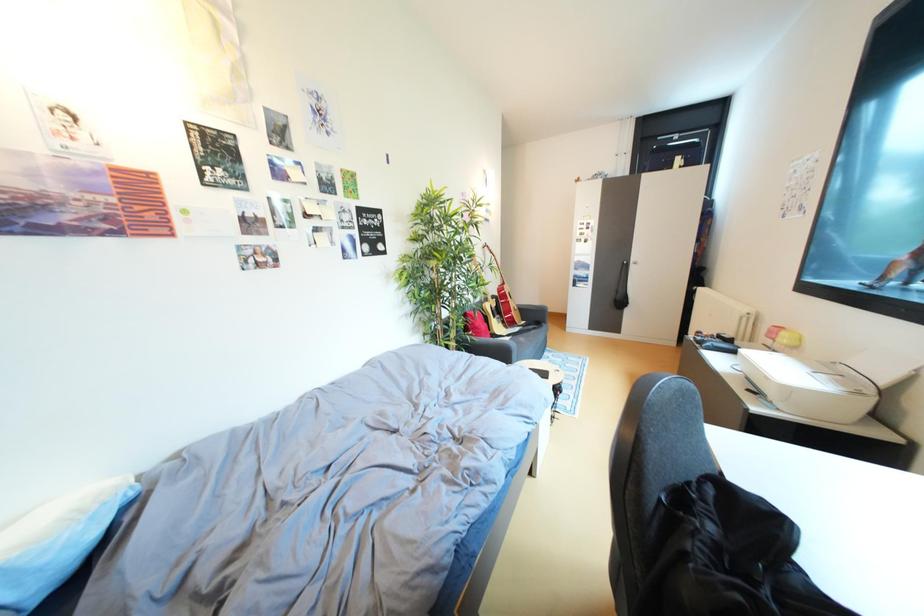
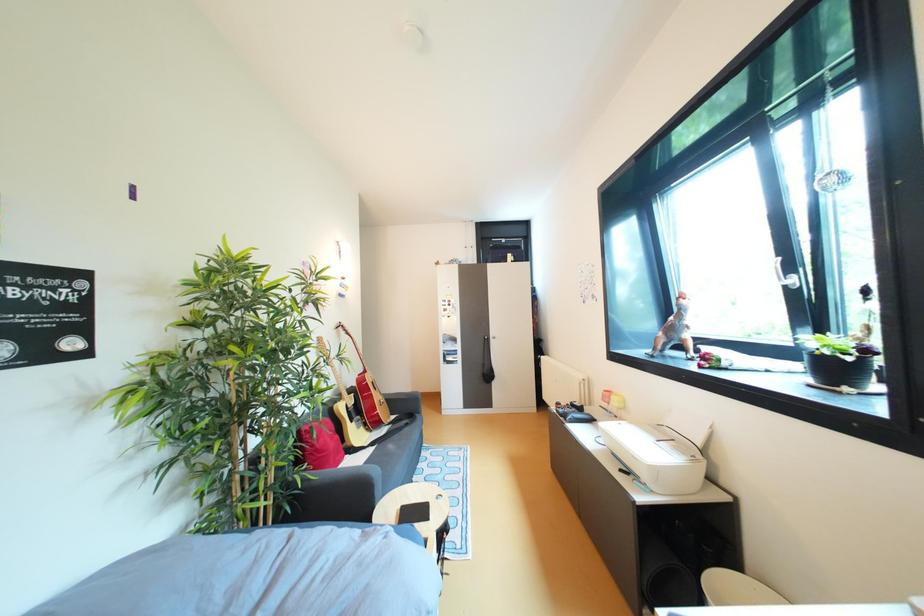
Question: The camera is either moving clockwise (left) or counter-clockwise (right) around the object. The first image is from the beginning of the video and the second image is from the end. Is the camera moving left or right when shooting the video?

Choices:
 (A) Left
 (B) Right

Answer: (A)